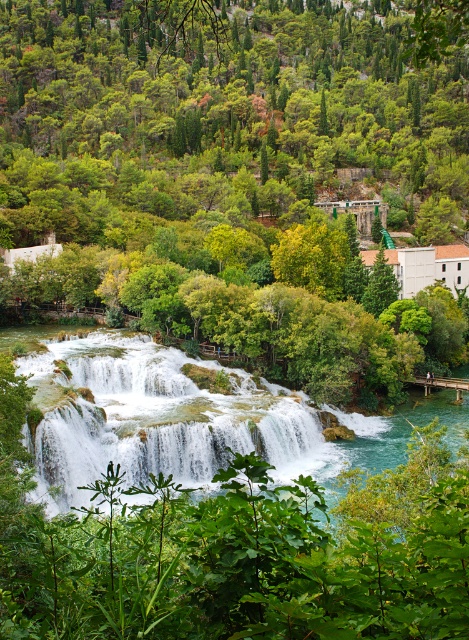
Question: Is green leafy tree at center positioned before white frothy water at center?

Choices:
 (A) yes
 (B) no

Answer: (A)

Question: Is green leafy tree at center to the right of white frothy water at center from the viewer's perspective?

Choices:
 (A) no
 (B) yes

Answer: (A)

Question: Does green leafy tree at center lie behind white frothy water at center?

Choices:
 (A) no
 (B) yes

Answer: (A)

Question: Which point appears farthest from the camera in this image?

Choices:
 (A) (128, 173)
 (B) (22, 336)

Answer: (A)

Question: Which of the following is the farthest from the observer?

Choices:
 (A) (39, 364)
 (B) (134, 45)

Answer: (B)